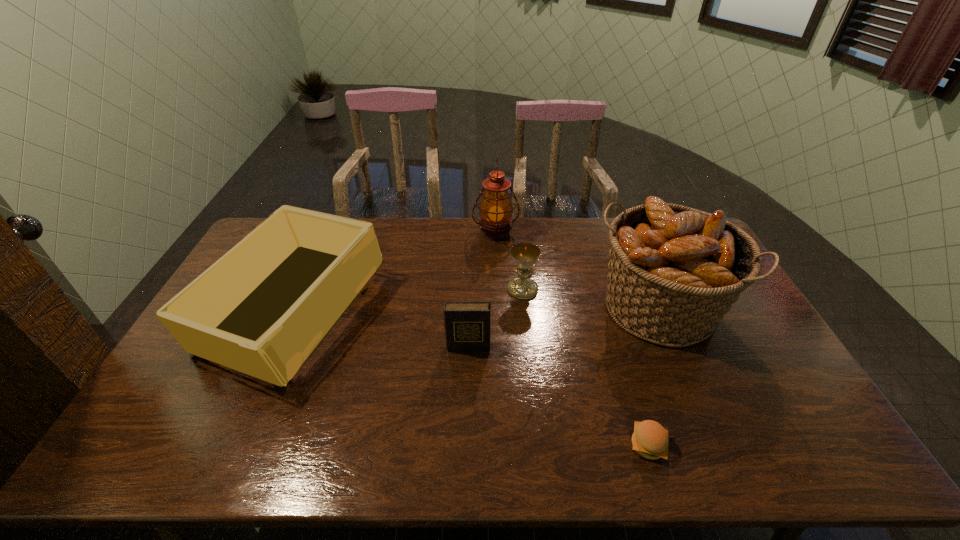
Locate an element on the screen. vacant space located 0.090m on the right of the fourth shortest object is located at coordinates (406, 312).

This screenshot has height=540, width=960. What are the coordinates of `vacant position located 0.320m on the front cover of the diary` in the screenshot? It's located at (465, 460).

This screenshot has width=960, height=540. I want to click on vacant space located on the right of the chalice, so click(x=563, y=289).

You are a GUI agent. You are given a task and a screenshot of the screen. Output one action in this format:
    pyautogui.click(x=<x>, y=<y>)
    Task: Click on the vacant space located 0.270m on the right of the hamburger
    
    Given the screenshot: What is the action you would take?
    click(781, 446)

Locate an element on the screen. The height and width of the screenshot is (540, 960). oil lamp that is at the far edge is located at coordinates (496, 208).

Image resolution: width=960 pixels, height=540 pixels. I want to click on box positioned at the far edge, so click(x=262, y=309).

I want to click on object that is positioned at the near edge, so click(x=650, y=439).

You are a GUI agent. You are given a task and a screenshot of the screen. Output one action in this format:
    pyautogui.click(x=<x>, y=<y>)
    Task: Click on the object located at the left edge
    
    Given the screenshot: What is the action you would take?
    pyautogui.click(x=262, y=309)

This screenshot has height=540, width=960. In order to click on object that is at the right edge in this screenshot , I will do `click(674, 271)`.

At what (x,y) coordinates should I click in order to perform the action: click on object that is at the far left corner. Please return your answer as a coordinate pair (x, y). This screenshot has width=960, height=540. Looking at the image, I should click on (262, 309).